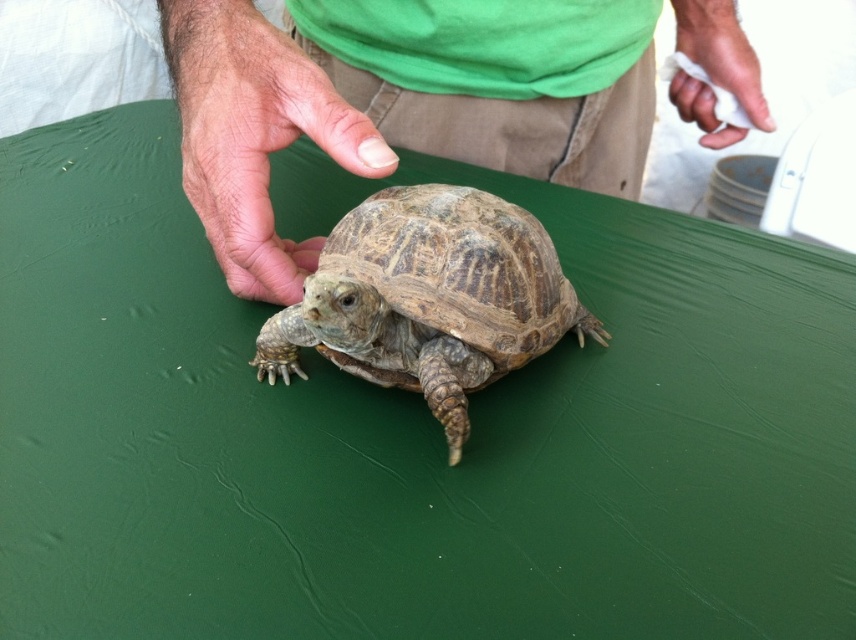
Question: From the image, what is the correct spatial relationship of green matte shirt at center in relation to white paper towel at upper right?

Choices:
 (A) left
 (B) right

Answer: (A)

Question: Which object appears closest to the camera in this image?

Choices:
 (A) fur skin hand at center
 (B) green matte shirt at center
 (C) white paper towel at upper right

Answer: (A)

Question: Considering the relative positions of leathery brown tortoise at center and green matte shirt at center in the image provided, where is leathery brown tortoise at center located with respect to green matte shirt at center?

Choices:
 (A) left
 (B) right

Answer: (B)

Question: Is green matte shirt at center to the left of fur skin hand at center from the viewer's perspective?

Choices:
 (A) yes
 (B) no

Answer: (B)

Question: Which point is farther to the camera?

Choices:
 (A) (709, 51)
 (B) (602, 339)

Answer: (A)

Question: Which object is positioned farthest from the leathery brown tortoise at center?

Choices:
 (A) fur skin hand at center
 (B) white paper towel at upper right
 (C) green matte shirt at center

Answer: (B)